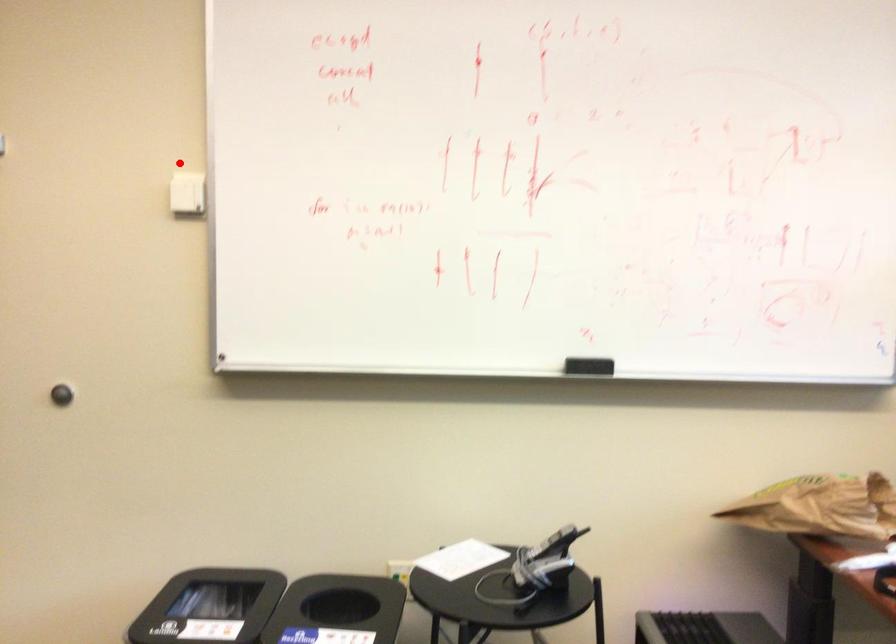
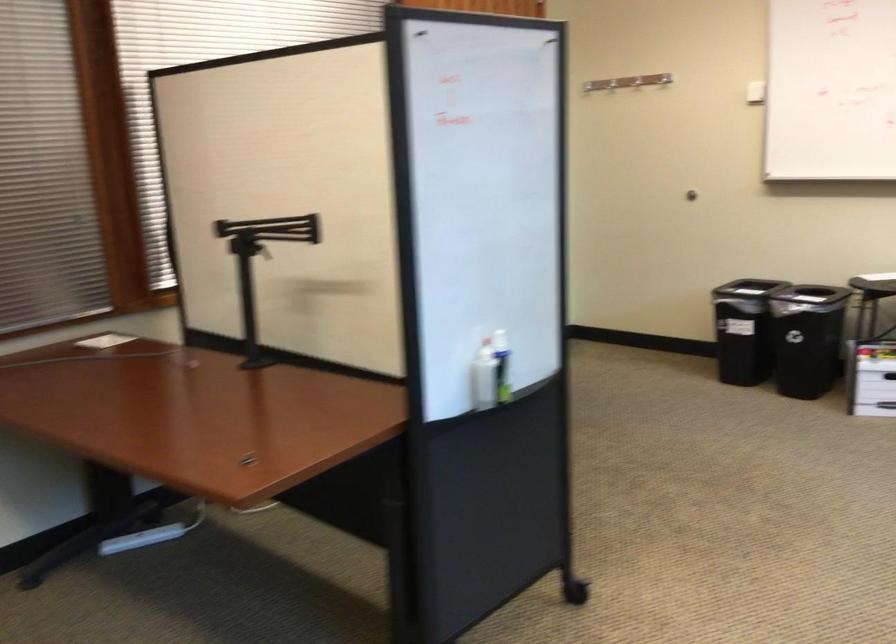
Question: I am providing you with two images of the same scene from different viewpoints. A red point is marked on the first image. At the location where the point appears in image 1, is it still visible in image 2?

Choices:
 (A) Yes
 (B) No

Answer: (A)